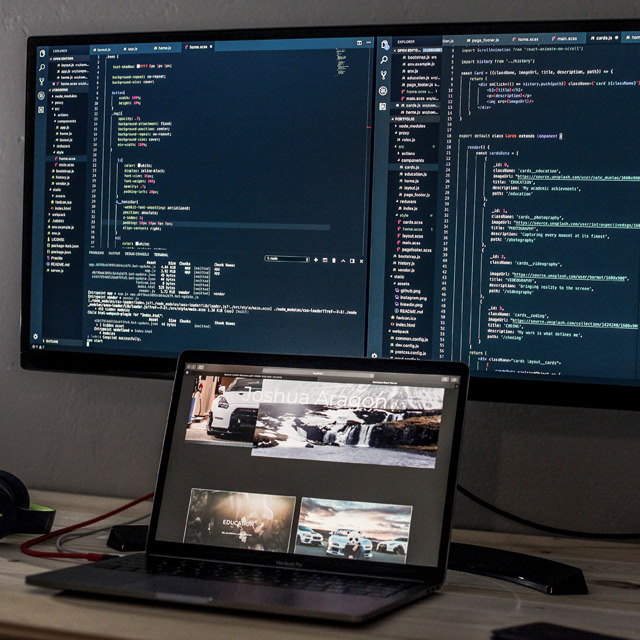
The width and height of the screenshot is (640, 640). I want to click on table, so click(456, 604).